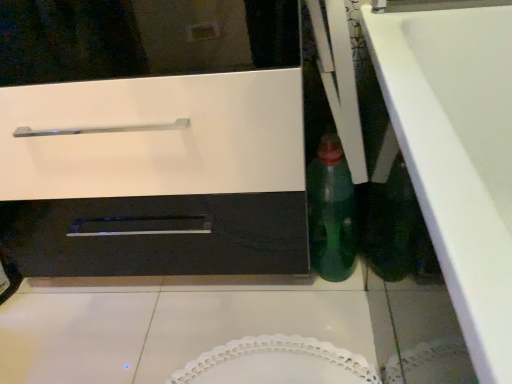
Question: Does green glass bottle at center-right have a lesser height compared to white glossy oven at center?

Choices:
 (A) no
 (B) yes

Answer: (B)

Question: Considering the relative sizes of green glass bottle at center-right and white glossy oven at center in the image provided, is green glass bottle at center-right taller than white glossy oven at center?

Choices:
 (A) no
 (B) yes

Answer: (A)

Question: Is green glass bottle at center-right touching white glossy oven at center?

Choices:
 (A) no
 (B) yes

Answer: (A)

Question: Is green glass bottle at center-right bigger than white glossy oven at center?

Choices:
 (A) no
 (B) yes

Answer: (A)

Question: Considering the relative positions of green glass bottle at center-right and white glossy oven at center in the image provided, is green glass bottle at center-right in front of white glossy oven at center?

Choices:
 (A) no
 (B) yes

Answer: (A)

Question: Does green glass bottle at center-right lie behind white glossy oven at center?

Choices:
 (A) yes
 (B) no

Answer: (A)

Question: Can you confirm if white glossy counter top at lower right is shorter than white glossy oven at center?

Choices:
 (A) no
 (B) yes

Answer: (B)

Question: Is white glossy counter top at lower right wider than white glossy oven at center?

Choices:
 (A) yes
 (B) no

Answer: (B)

Question: Is white glossy counter top at lower right closer to the viewer compared to white glossy oven at center?

Choices:
 (A) no
 (B) yes

Answer: (B)

Question: Are white glossy counter top at lower right and white glossy oven at center far apart?

Choices:
 (A) yes
 (B) no

Answer: (B)

Question: Does white glossy counter top at lower right have a greater height compared to white glossy oven at center?

Choices:
 (A) yes
 (B) no

Answer: (B)

Question: Would you say white glossy oven at center is part of white glossy counter top at lower right's contents?

Choices:
 (A) yes
 (B) no

Answer: (B)

Question: Does white glossy oven at center have a larger size compared to white glossy counter top at lower right?

Choices:
 (A) yes
 (B) no

Answer: (A)